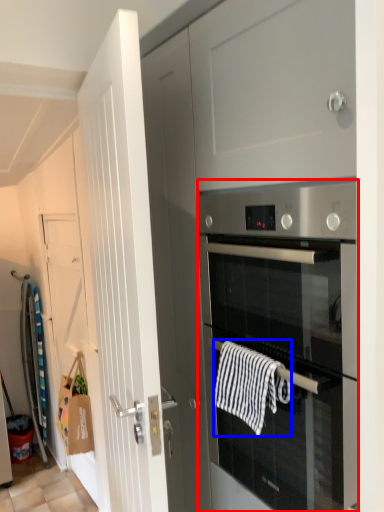
Question: Which point is closer to the camera, oven (highlighted by a red box) or hand towel (highlighted by a blue box)?

Choices:
 (A) oven
 (B) hand towel

Answer: (A)